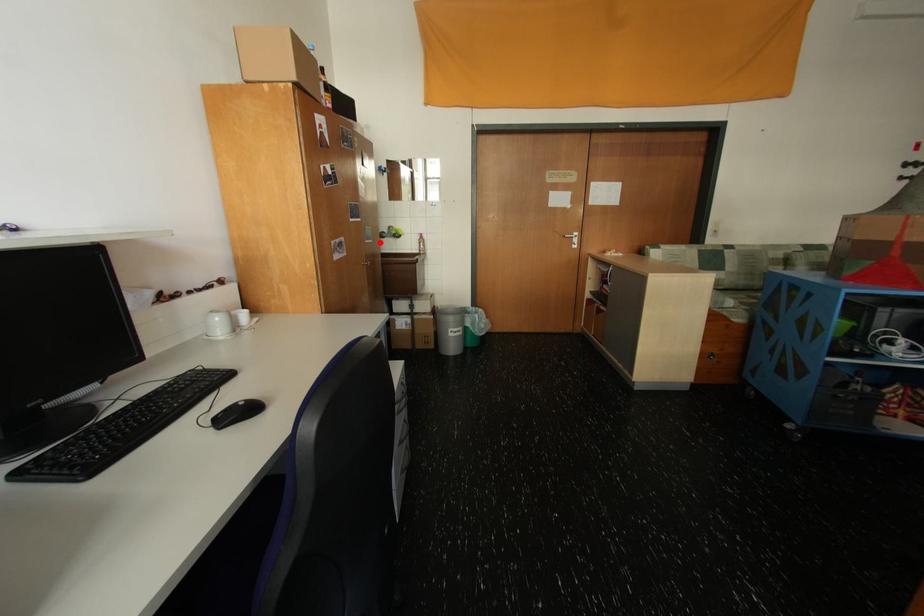
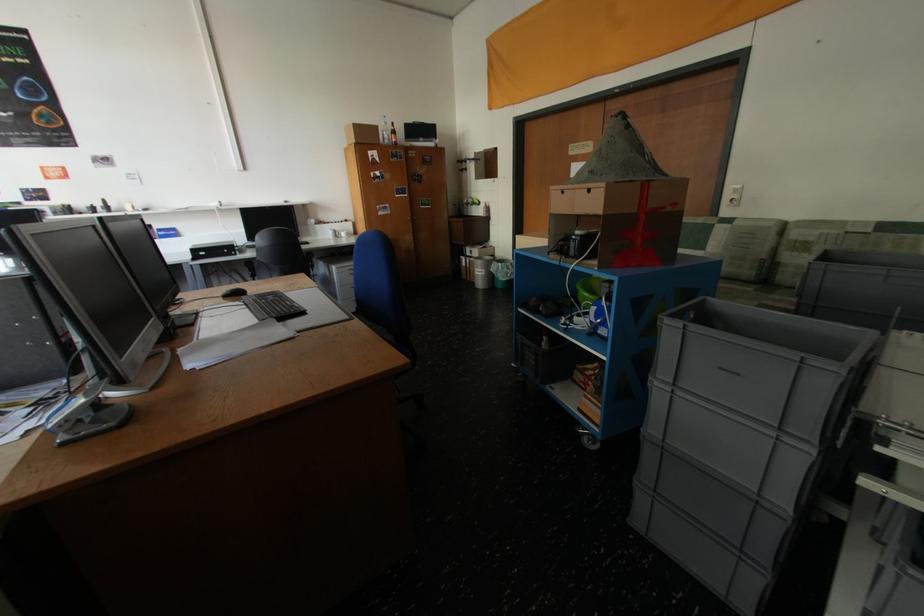
Question: I am providing you with two images of the same scene from different viewpoints. Given a red point in image1, look at the same physical point in image2. Is it:

Choices:
 (A) Closer to the viewpoint
 (B) Farther from the viewpoint

Answer: (A)